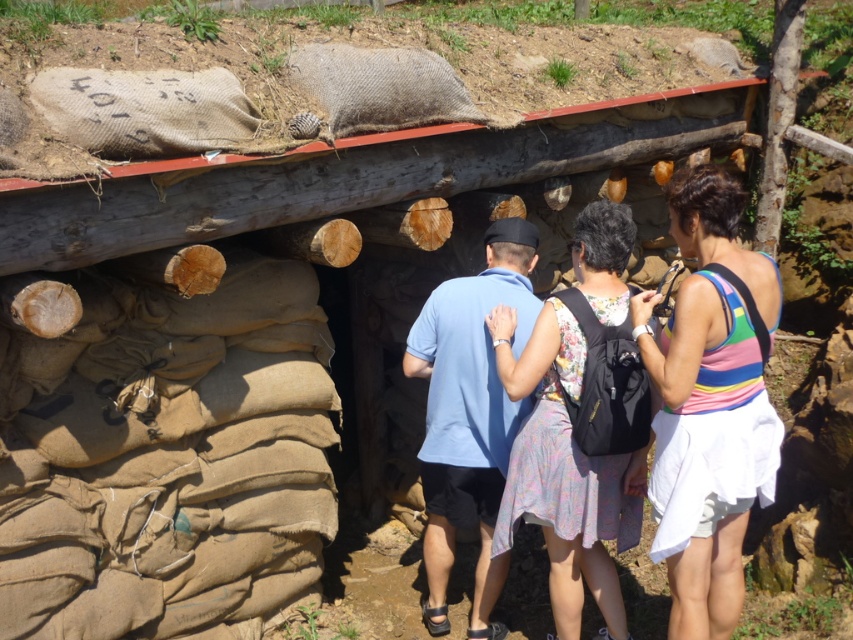
Who is shorter, rainbow striped tank top at center or blue cotton shirt at center?

With less height is rainbow striped tank top at center.

Is point (720, 403) positioned after point (447, 529)?

No, (720, 403) is closer to viewer.

Where is `rainbow striped tank top at center`? The height and width of the screenshot is (640, 853). rainbow striped tank top at center is located at coordinates (709, 406).

Does rainbow striped tank top at center have a smaller size compared to floral fabric dress at center?

Yes, rainbow striped tank top at center is smaller than floral fabric dress at center.

Is point (740, 497) positioned in front of point (581, 262)?

Yes.

In order to click on rainbow striped tank top at center in this screenshot , I will do `click(709, 406)`.

In the scene shown: Which is above, floral fabric dress at center or blue cotton shirt at center?

Positioned higher is floral fabric dress at center.

Who is shorter, floral fabric dress at center or blue cotton shirt at center?

floral fabric dress at center

The image size is (853, 640). Find the location of `floral fabric dress at center`. floral fabric dress at center is located at coordinates (564, 472).